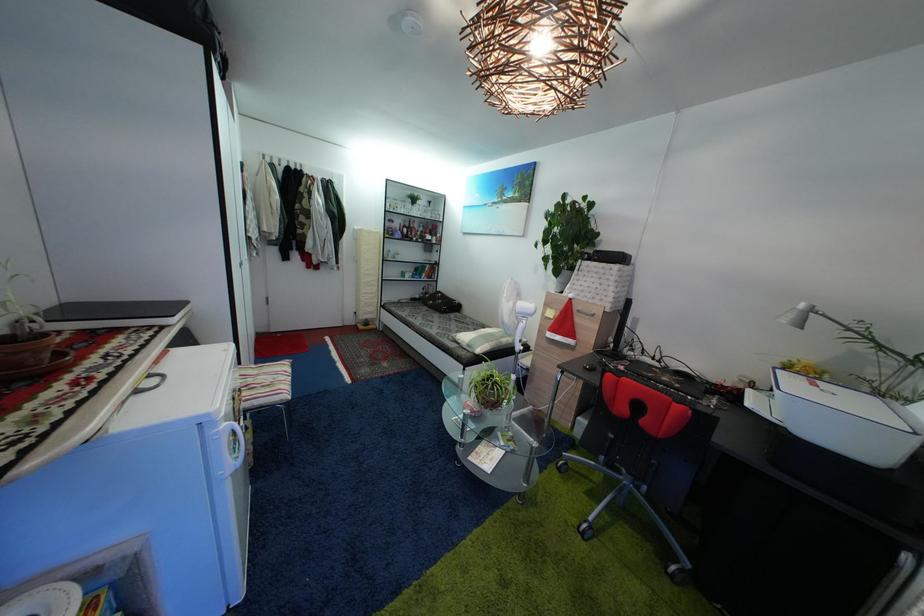
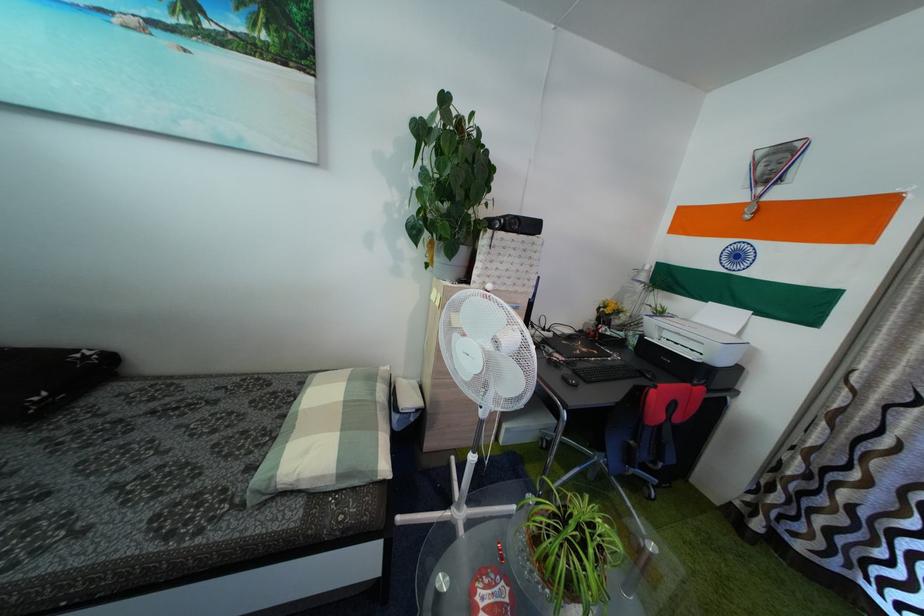
Locate, in the second image, the point that corresponds to (477,353) in the first image.

(347, 483)